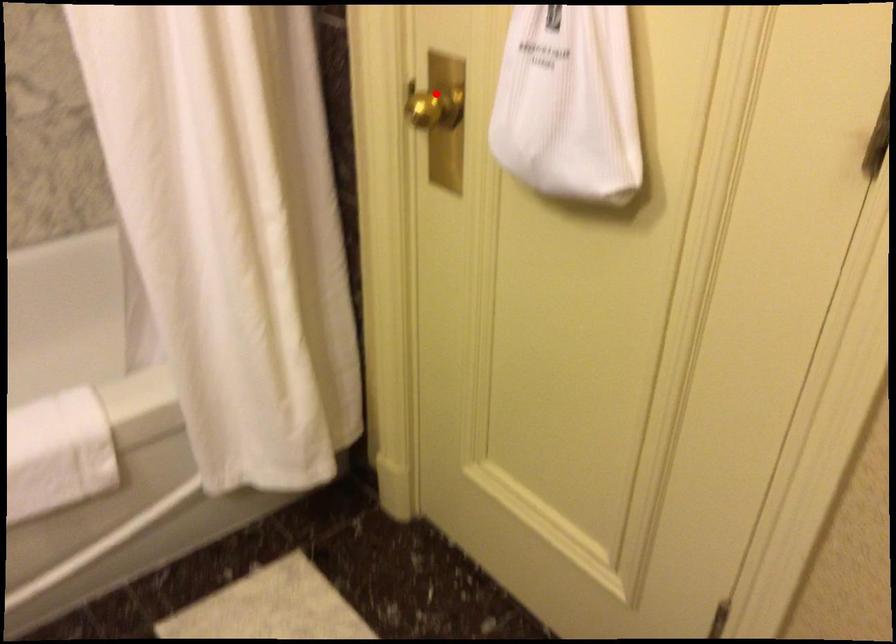
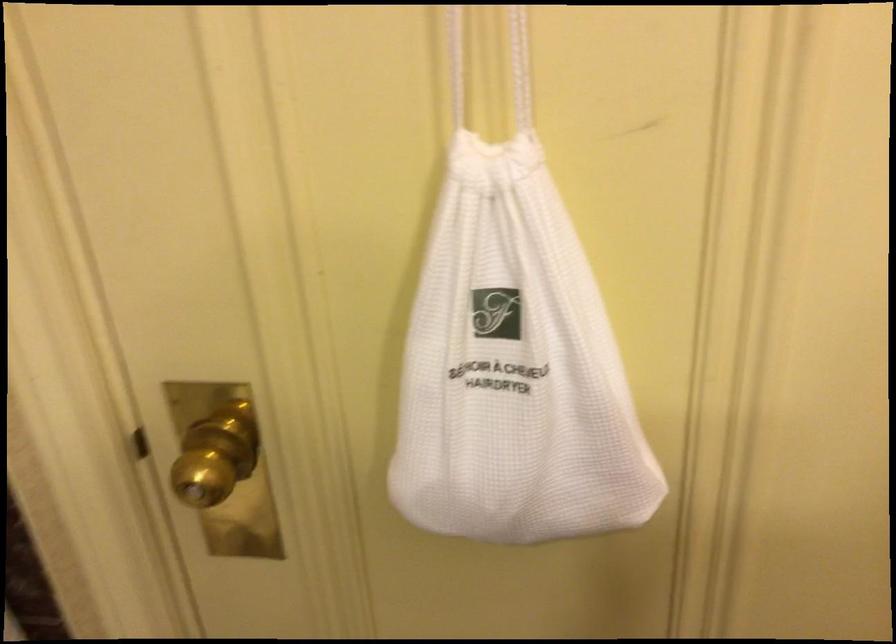
The point at the highlighted location is marked in the first image. Where is the corresponding point in the second image?

(216, 456)